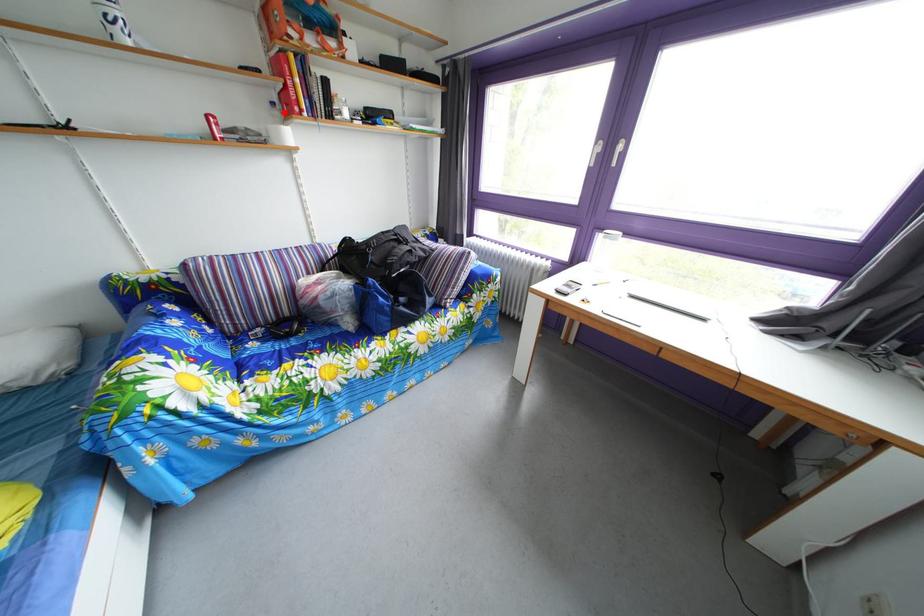
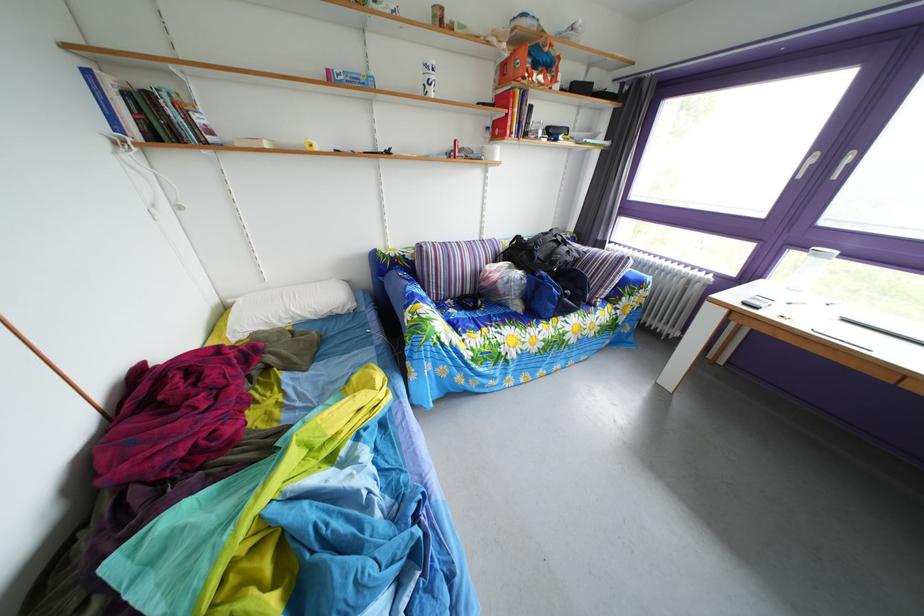
Find the pixel in the second image that matches the highlighted location in the first image.

(499, 137)